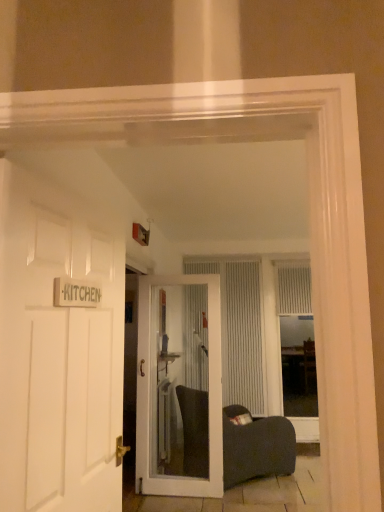
Question: Is white textured curtain at center, which appears as the 1th curtain when viewed from the left, with white textured blinds at center?

Choices:
 (A) yes
 (B) no

Answer: (B)

Question: Can you confirm if white textured curtain at center, which appears as the 1th curtain when viewed from the left, is smaller than white textured blinds at center?

Choices:
 (A) no
 (B) yes

Answer: (B)

Question: Considering the relative sizes of white textured curtain at center, which appears as the 1th curtain when viewed from the left, and white textured blinds at center in the image provided, is white textured curtain at center, which appears as the 1th curtain when viewed from the left, taller than white textured blinds at center?

Choices:
 (A) no
 (B) yes

Answer: (A)

Question: Is white textured curtain at center, which appears as the 1th curtain when viewed from the left, outside of white textured blinds at center?

Choices:
 (A) no
 (B) yes

Answer: (B)

Question: Is the depth of white textured curtain at center, the second curtain from the right, less than that of white textured blinds at center?

Choices:
 (A) yes
 (B) no

Answer: (B)

Question: From the image's perspective, is white textured curtain at center, the second curtain from the right, beneath white textured blinds at center?

Choices:
 (A) yes
 (B) no

Answer: (B)

Question: Is white textured blinds at center to the right of white textured curtain at center, acting as the first curtain starting from the right, from the viewer's perspective?

Choices:
 (A) no
 (B) yes

Answer: (B)

Question: Is white textured blinds at center wider than white textured curtain at center, acting as the first curtain starting from the right?

Choices:
 (A) no
 (B) yes

Answer: (B)

Question: Is white textured blinds at center facing towards white textured curtain at center, which ranks as the second curtain in left-to-right order?

Choices:
 (A) no
 (B) yes

Answer: (B)

Question: Is white textured blinds at center taller than white textured curtain at center, acting as the first curtain starting from the right?

Choices:
 (A) yes
 (B) no

Answer: (A)

Question: Does white textured blinds at center have a lesser width compared to white textured curtain at center, acting as the first curtain starting from the right?

Choices:
 (A) no
 (B) yes

Answer: (A)

Question: From the image's perspective, would you say white textured blinds at center is shown under white textured curtain at center, which ranks as the second curtain in left-to-right order?

Choices:
 (A) no
 (B) yes

Answer: (B)

Question: Can you confirm if white wooden door at left, arranged as the second door when viewed from the back, is shorter than clear glass door at center, acting as the 1th door starting from the back?

Choices:
 (A) no
 (B) yes

Answer: (B)